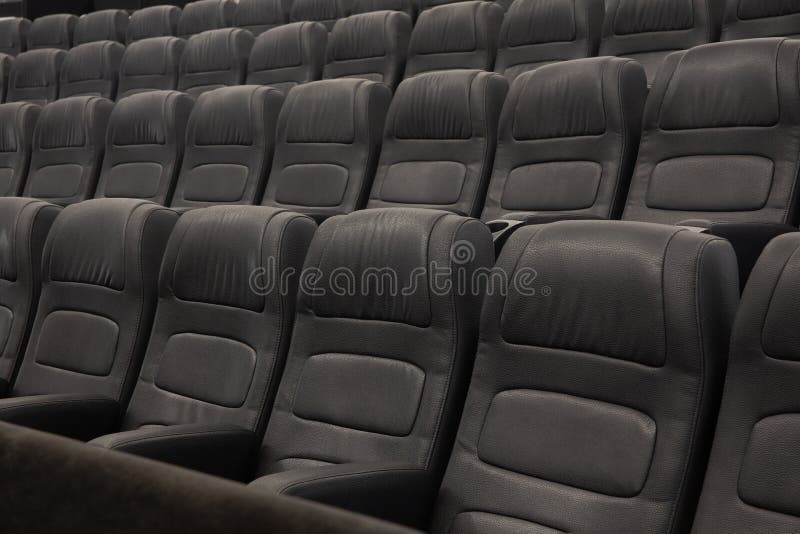
This screenshot has width=800, height=534. I want to click on chairs in highest visible row, so click(14, 31), click(46, 23), click(106, 21), click(156, 22), click(208, 19), click(266, 7), click(334, 15), click(373, 5).